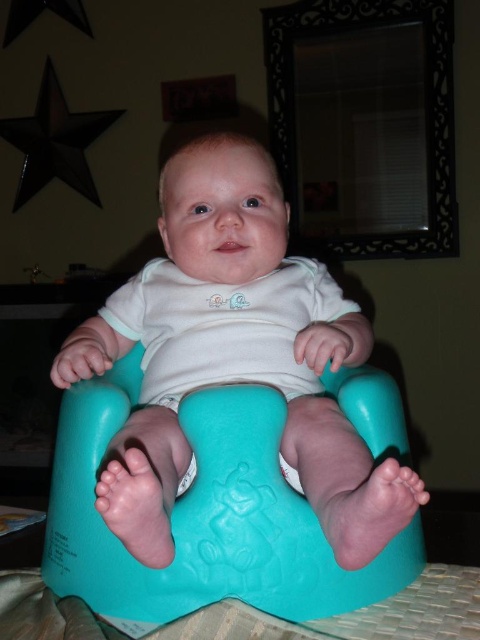
Question: Is teal rubber potty at center thinner than teal plastic feeding chair at center?

Choices:
 (A) no
 (B) yes

Answer: (B)

Question: Can you confirm if teal rubber potty at center is smaller than teal plastic feeding chair at center?

Choices:
 (A) yes
 (B) no

Answer: (B)

Question: Among these points, which one is farthest from the camera?

Choices:
 (A) (383, 385)
 (B) (252, 339)

Answer: (B)

Question: In this image, where is teal rubber potty at center located relative to teal plastic feeding chair at center?

Choices:
 (A) below
 (B) above

Answer: (B)

Question: Which of the following is the closest to the observer?

Choices:
 (A) teal plastic feeding chair at center
 (B) teal rubber potty at center

Answer: (B)